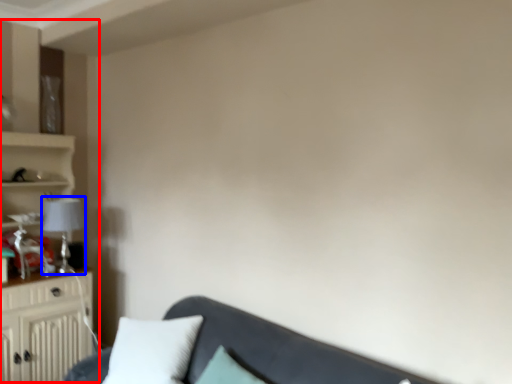
Question: Which object appears closest to the camera in this image, entertainment center (highlighted by a red box) or lamp (highlighted by a blue box)?

Choices:
 (A) entertainment center
 (B) lamp

Answer: (A)